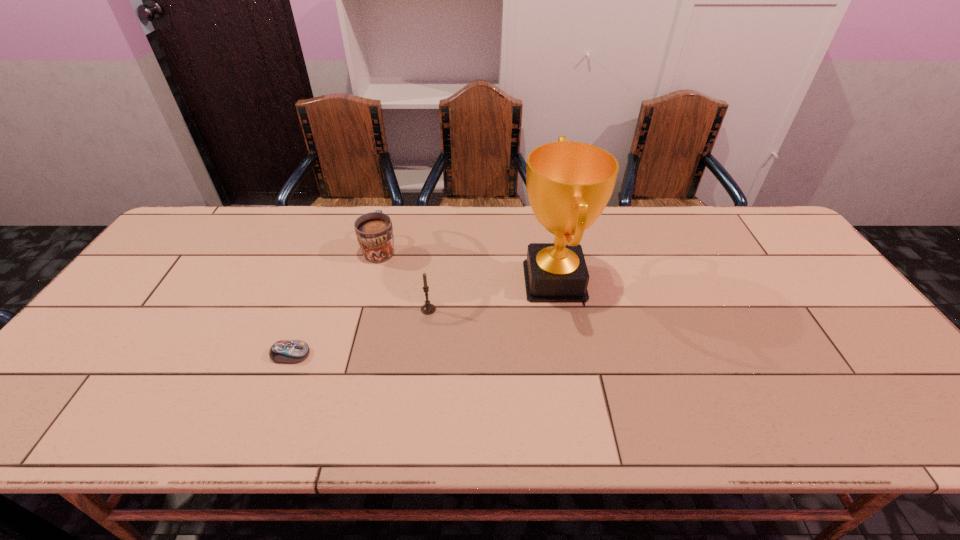
Locate an element on the screen. This screenshot has height=540, width=960. unoccupied position between the candle and the mug is located at coordinates (404, 279).

Where is `free spot between the rightmost object and the mug`? free spot between the rightmost object and the mug is located at coordinates point(468,265).

Locate which object ranks in proximity to the shortest object. Please provide its 2D coordinates. Your answer should be formatted as a tuple, i.e. [(x, y)], where the tuple contains the x and y coordinates of a point satisfying the conditions above.

[(427, 309)]

Identify which object is the third nearest to the shortest object. Please provide its 2D coordinates. Your answer should be formatted as a tuple, i.e. [(x, y)], where the tuple contains the x and y coordinates of a point satisfying the conditions above.

[(569, 184)]